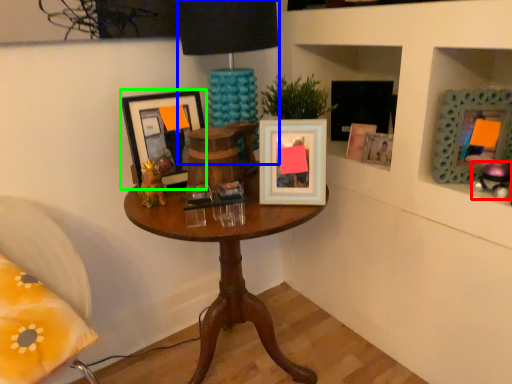
Question: Which object is the closest to the toy (highlighted by a red box)? Choose among these: table lamp (highlighted by a blue box) or picture frame (highlighted by a green box).

Choices:
 (A) table lamp
 (B) picture frame

Answer: (A)